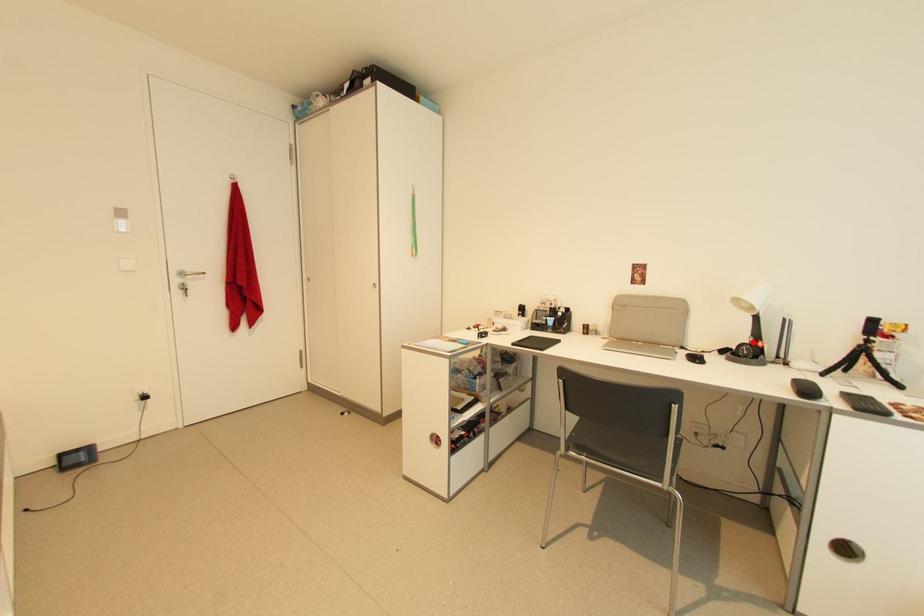
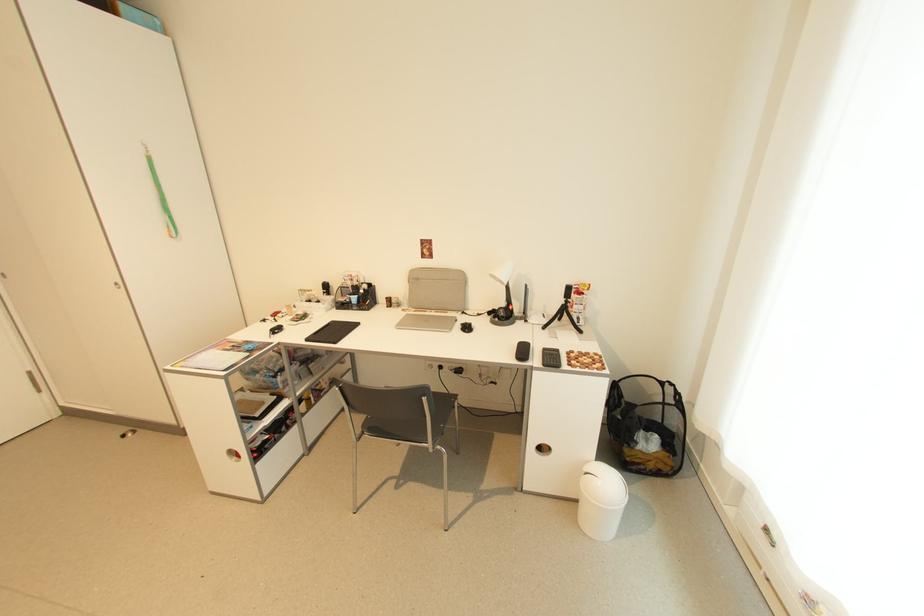
Find the pixel in the second image that matches the highlighted location in the first image.

(507, 306)